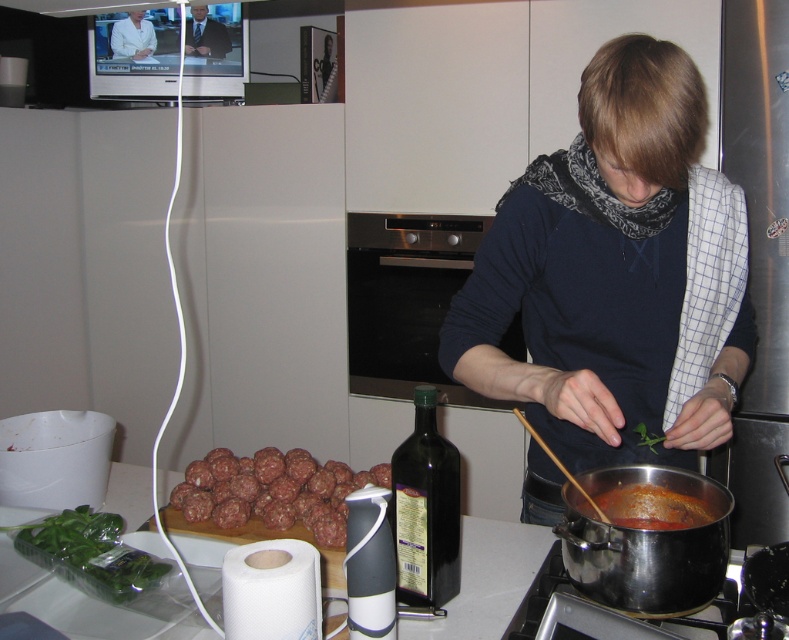
Who is higher up, dark blue sweater at center or smooth skin person at center?

Positioned higher is smooth skin person at center.

Between dark blue sweater at center and smooth skin person at center, which one appears on the left side from the viewer's perspective?

smooth skin person at center is more to the left.

Describe the element at coordinates (604, 275) in the screenshot. Image resolution: width=789 pixels, height=640 pixels. I see `dark blue sweater at center` at that location.

The image size is (789, 640). What are the coordinates of `dark blue sweater at center` in the screenshot? It's located at (604, 275).

Who is lower down, brown meatballs at lower left or stainless steel pot at lower center?

stainless steel pot at lower center

Which is above, brown meatballs at lower left or stainless steel pot at lower center?

brown meatballs at lower left is higher up.

Is point (339, 513) less distant than point (586, 605)?

No.

The image size is (789, 640). Find the location of `brown meatballs at lower left`. brown meatballs at lower left is located at coordinates (275, 492).

Between dark blue sweater at center and brown meatballs at lower left, which one is positioned lower?

brown meatballs at lower left is below.

Can you confirm if dark blue sweater at center is positioned above brown meatballs at lower left?

Yes, dark blue sweater at center is above brown meatballs at lower left.

Is point (606, 195) farther from viewer compared to point (309, 484)?

No, it is in front of (309, 484).

Locate an element on the screen. This screenshot has height=640, width=789. dark blue sweater at center is located at coordinates (604, 275).